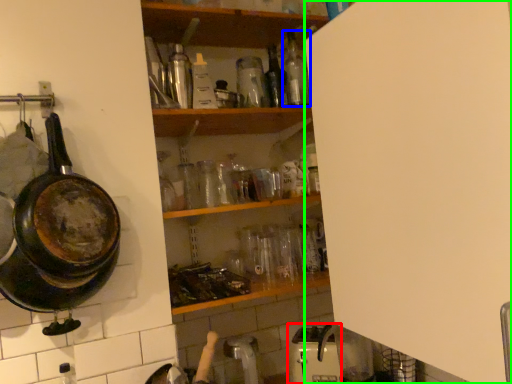
Question: Considering the real-world distances, which object is closest to appliance (highlighted by a red box)? bottle (highlighted by a blue box) or side (highlighted by a green box).

Choices:
 (A) bottle
 (B) side

Answer: (B)